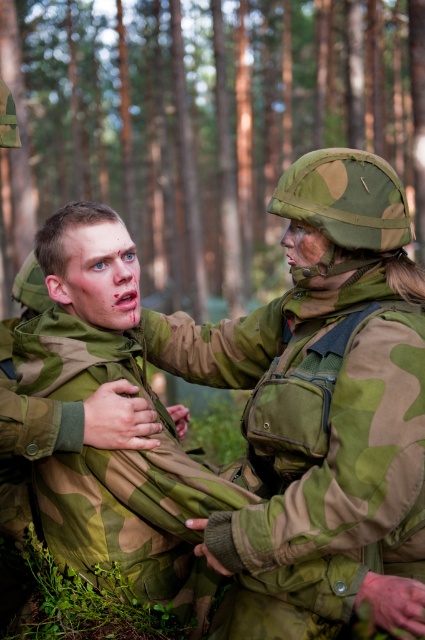
What is the 2D coordinate of the green camouflage pine forest at upper center in the image?

The green camouflage pine forest at upper center is located at the 2D coordinate point of (203,125).

You are a drone operator trying to locate a safe landing zone. You observe a green camouflage pine forest at upper center at point (203, 125). Is there enough space to land a drone there?

The point (203, 125) is occupied by green camouflage pine forest at upper center, so there is no space to land a drone there.

You are a drone operator trying to locate a hidden military unit in the forest. You see the camo uniform at center and the green camouflage pine forest at upper center. Which object is closer to the front of the image?

The green camouflage pine forest at upper center is closer to the front of the image because the camo uniform at center is behind it.